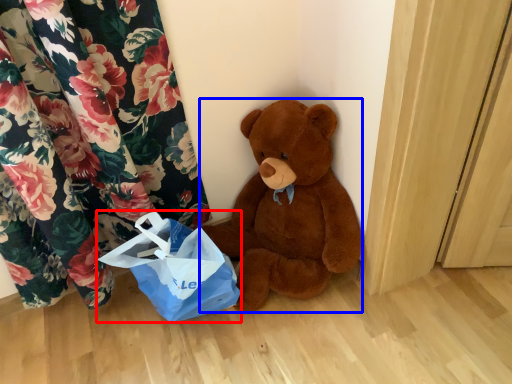
Question: Which of the following is the closest to the observer, grocery bag (highlighted by a red box) or teddy bear (highlighted by a blue box)?

Choices:
 (A) grocery bag
 (B) teddy bear

Answer: (B)